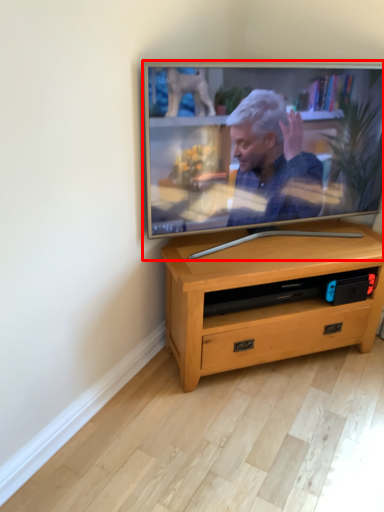
Question: From the image's perspective, what is the correct spatial positioning of television (annotated by the red box) in reference to desk?

Choices:
 (A) below
 (B) above

Answer: (B)